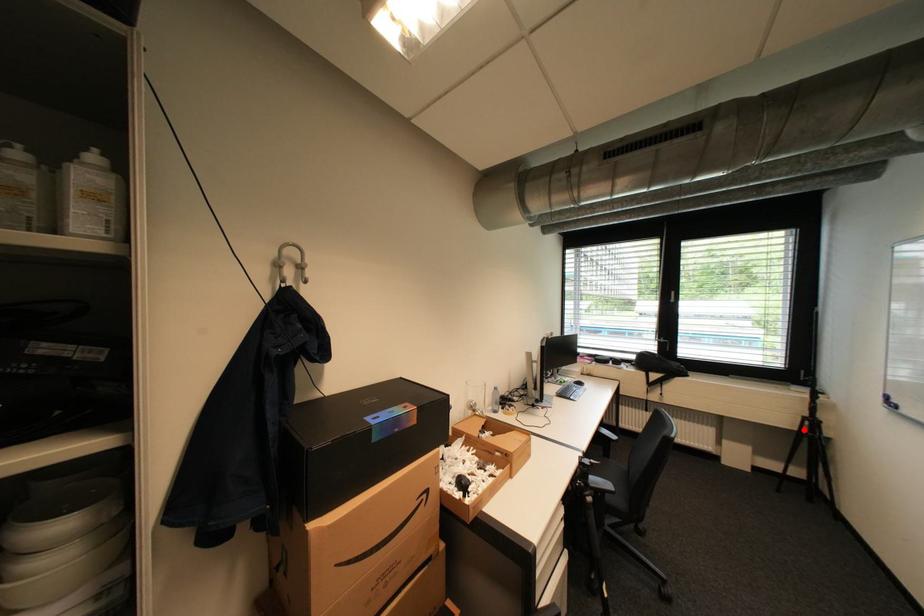
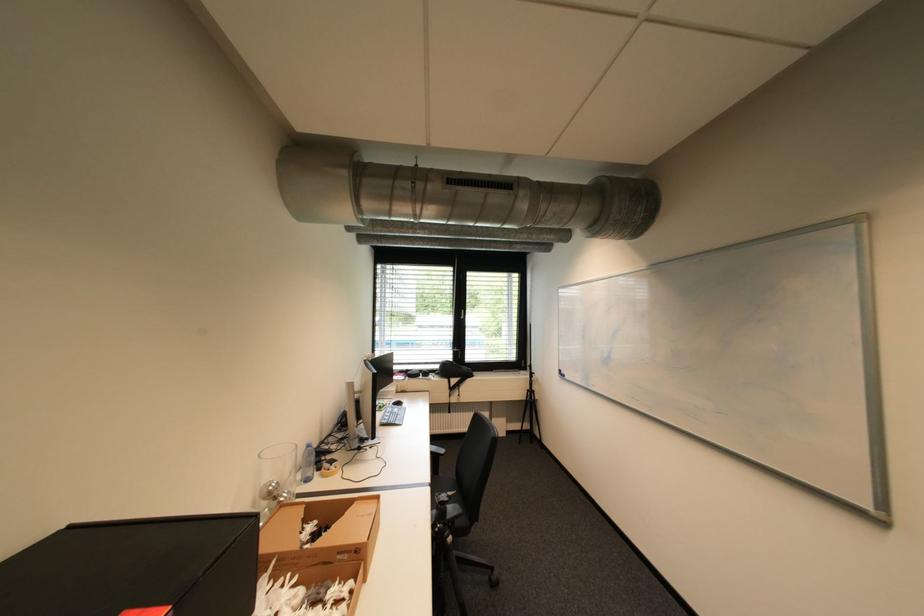
The point at the highlighted location is marked in the first image. Where is the corresponding point in the second image?

(532, 400)